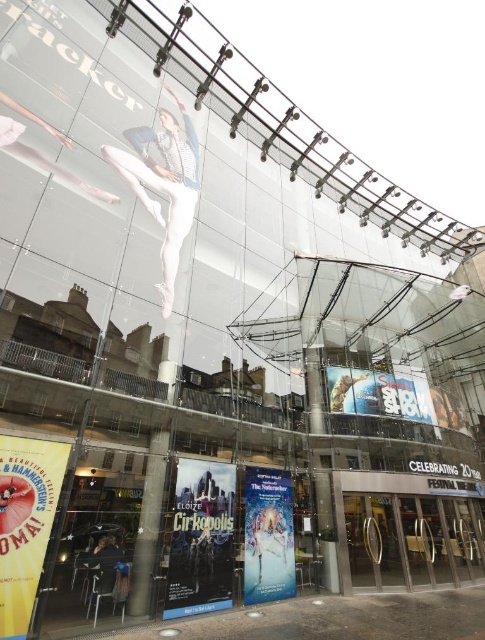
You are standing in front of the modern theater building and want to locate two specific points on the glass facade. The first point is at coordinates point (x=350, y=540) and the second is at point (x=245, y=525). Which point appears closer to you when looking at the glass facade?

Point (x=350, y=540) is further to the viewer than point (x=245, y=525), so the first point appears closer to you.

You are standing at the point labeled point (49, 472) and want to take a photo of the theater entrance. If your camera has a focal length of 50mm and you want to capture the entire theater entrance in one shot, what is the minimum distance you should be from the entrance?

The point labeled point (49, 472) is 5.91 meters away from the camera. To capture the entire theater entrance in one shot with a 50mm focal length, you should be at least 5.91 meters away from the entrance.